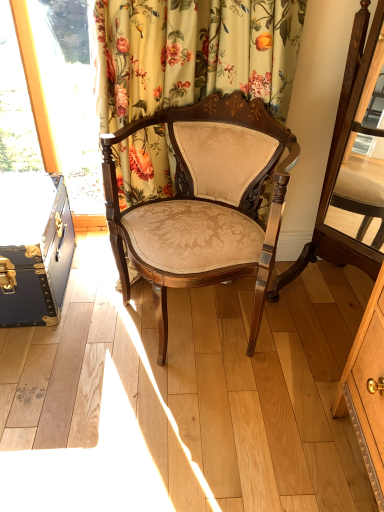
The image size is (384, 512). Identify the location of vacant space in front of matte brown wood swivel chair at center. (309, 371).